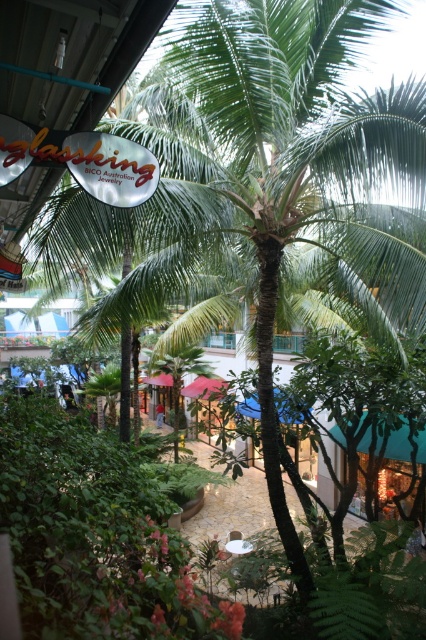
Is point (423, 438) positioned behind point (46, 330)?

No, (423, 438) is in front of (46, 330).

The image size is (426, 640). Identify the location of teal fabric canopy at center. (399, 444).

Does blue fabric canopy at lower left have a lesser height compared to pink fabric canopy at center?

No.

Identify the location of blue fabric canopy at lower left. (36, 324).

Which is above, green fabric canopy at center or pink fabric canopy at center?

Positioned higher is green fabric canopy at center.

Does point (250, 401) lie in front of point (161, 372)?

Yes, it is.

At what (x,y) coordinates should I click in order to perform the action: click on green fabric canopy at center. Please return your answer as a coordinate pair (x, y). Image resolution: width=426 pixels, height=640 pixels. Looking at the image, I should click on (287, 408).